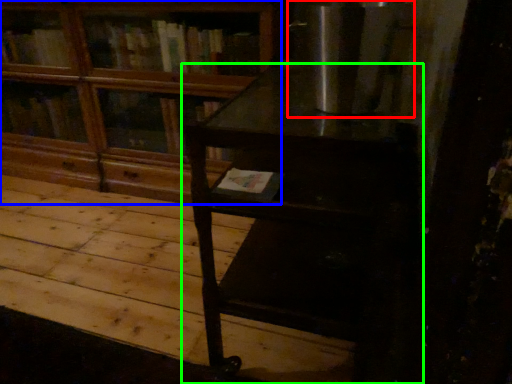
Question: Considering the real-world distances, which object is farthest from appliance (highlighted by a red box)? bookcase (highlighted by a blue box) or table (highlighted by a green box)?

Choices:
 (A) bookcase
 (B) table

Answer: (A)